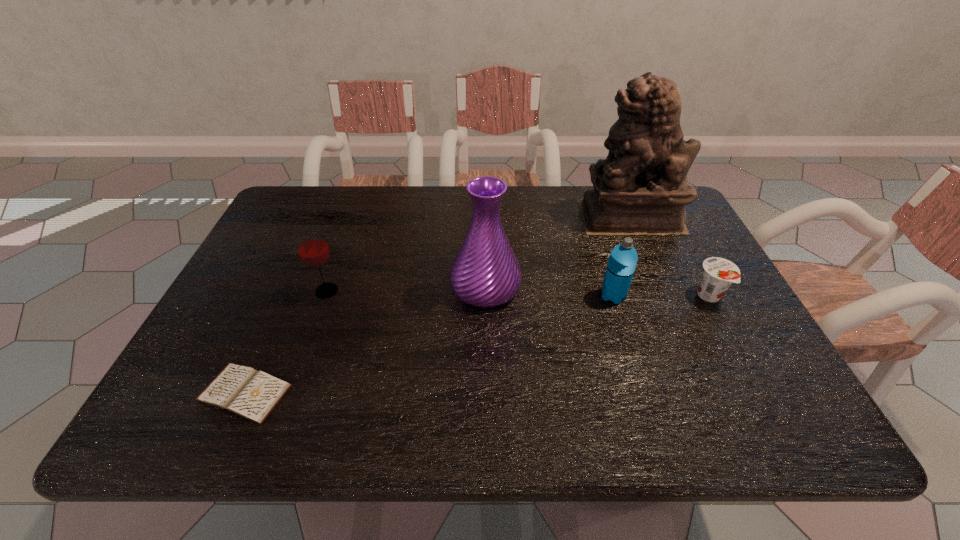
Image resolution: width=960 pixels, height=540 pixels. Identify the location of free space located on the front-facing side of the tallest object. (478, 216).

In order to click on vacant space situated on the front-facing side of the tallest object in this screenshot , I will do click(515, 216).

You are a GUI agent. You are given a task and a screenshot of the screen. Output one action in this format:
    pyautogui.click(x=<x>, y=<y>)
    Task: Click on the vacant region located on the left of the vase
    
    Given the screenshot: What is the action you would take?
    pyautogui.click(x=394, y=287)

Where is `vacant position located 0.320m on the front of the glass`? This screenshot has height=540, width=960. vacant position located 0.320m on the front of the glass is located at coordinates (279, 423).

The height and width of the screenshot is (540, 960). In order to click on vacant space located 0.090m on the front of the thermos bottle in this screenshot , I will do `click(625, 334)`.

I want to click on vacant space located on the back of the second shortest object, so click(x=678, y=237).

At what (x,y) coordinates should I click in order to perform the action: click on vacant space situated 0.150m on the right of the diary. Please return your answer as a coordinate pair (x, y). Looking at the image, I should click on (365, 393).

The height and width of the screenshot is (540, 960). I want to click on object that is positioned at the far edge, so click(x=641, y=188).

What are the coordinates of `object that is at the near edge` in the screenshot? It's located at (251, 394).

At what (x,y) coordinates should I click in order to perform the action: click on object at the left edge. Please return your answer as a coordinate pair (x, y). The height and width of the screenshot is (540, 960). Looking at the image, I should click on (251, 394).